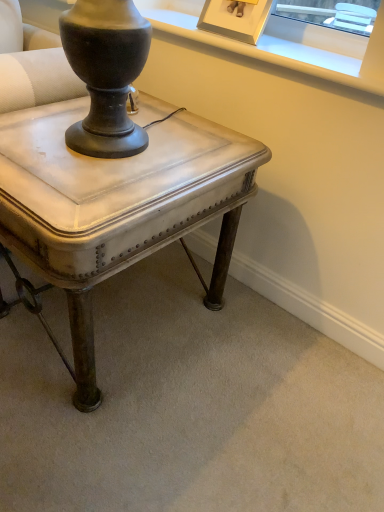
What do you see at coordinates (235, 19) in the screenshot? I see `gold-framed picture at upper center` at bounding box center [235, 19].

You are a GUI agent. You are given a task and a screenshot of the screen. Output one action in this format:
    pyautogui.click(x=<x>, y=<y>)
    Task: Click on the gold-framed picture at upper center
    This screenshot has width=384, height=512.
    Given the screenshot: What is the action you would take?
    pyautogui.click(x=235, y=19)

Locate an element on the screen. This screenshot has width=384, height=512. metallic silver table at center is located at coordinates (116, 206).

Describe the element at coordinates (116, 206) in the screenshot. I see `metallic silver table at center` at that location.

You are a GUI agent. You are given a task and a screenshot of the screen. Output one action in this format:
    pyautogui.click(x=<x>, y=<y>)
    Task: Click on the gold-framed picture at upper center
    The height and width of the screenshot is (512, 384).
    Given the screenshot: What is the action you would take?
    pyautogui.click(x=235, y=19)

Would you say metallic silver table at center is to the left or to the right of gold-framed picture at upper center in the picture?

In the image, metallic silver table at center appears on the left side of gold-framed picture at upper center.

Considering the relative positions of metallic silver table at center and gold-framed picture at upper center in the image provided, is metallic silver table at center in front of gold-framed picture at upper center?

Yes, it is.

Is point (51, 240) less distant than point (238, 40)?

That is True.

From the picture: From the image's perspective, is metallic silver table at center on top of gold-framed picture at upper center?

No, from the image's perspective, metallic silver table at center is not above gold-framed picture at upper center.

From a real-world perspective, relative to gold-framed picture at upper center, is metallic silver table at center vertically above or below?

Clearly, from a real-world perspective, metallic silver table at center is below gold-framed picture at upper center.

Considering the sizes of objects metallic silver table at center and gold-framed picture at upper center in the image provided, who is thinner, metallic silver table at center or gold-framed picture at upper center?

With smaller width is gold-framed picture at upper center.

Considering the relative sizes of metallic silver table at center and gold-framed picture at upper center in the image provided, is metallic silver table at center taller than gold-framed picture at upper center?

Correct, metallic silver table at center is much taller as gold-framed picture at upper center.

Who is bigger, metallic silver table at center or gold-framed picture at upper center?

metallic silver table at center.

Would you say metallic silver table at center is outside gold-framed picture at upper center?

Indeed, metallic silver table at center is completely outside gold-framed picture at upper center.

Is metallic silver table at center not near gold-framed picture at upper center?

That's not correct — metallic silver table at center is a little close to gold-framed picture at upper center.

Could you tell me if metallic silver table at center is facing gold-framed picture at upper center?

No, metallic silver table at center is not facing towards gold-framed picture at upper center.

Where is `table lying in front of the gold-framed picture at upper center`? table lying in front of the gold-framed picture at upper center is located at coordinates (116, 206).

Consider the image. Is gold-framed picture at upper center to the left or to the right of metallic silver table at center in the image?

From the image, it's evident that gold-framed picture at upper center is to the right of metallic silver table at center.

Considering their positions, is gold-framed picture at upper center located in front of or behind metallic silver table at center?

Visually, gold-framed picture at upper center is located behind metallic silver table at center.

Is point (254, 23) positioned before point (106, 264)?

No, it is not.

From the image's perspective, is gold-framed picture at upper center located above metallic silver table at center?

Correct, gold-framed picture at upper center appears higher than metallic silver table at center in the image.

From a real-world perspective, is gold-framed picture at upper center located beneath metallic silver table at center?

No.

Based on the photo, looking at their sizes, would you say gold-framed picture at upper center is wider or thinner than metallic silver table at center?

gold-framed picture at upper center is thinner than metallic silver table at center.

Between gold-framed picture at upper center and metallic silver table at center, which one has more height?

With more height is metallic silver table at center.

Is gold-framed picture at upper center smaller than metallic silver table at center?

Yes.

Do you think gold-framed picture at upper center is within metallic silver table at center, or outside of it?

gold-framed picture at upper center is not enclosed by metallic silver table at center.

Is gold-framed picture at upper center not near metallic silver table at center?

They are positioned close to each other.

Is gold-framed picture at upper center facing away from metallic silver table at center?

No, gold-framed picture at upper center is not facing the opposite direction of metallic silver table at center.

At what (x,y) coordinates should I click in order to perform the action: click on picture frame above the metallic silver table at center (from a real-world perspective). Please return your answer as a coordinate pair (x, y). Looking at the image, I should click on (235, 19).

Where is `table beneath the gold-framed picture at upper center (from a real-world perspective)`? This screenshot has height=512, width=384. table beneath the gold-framed picture at upper center (from a real-world perspective) is located at coordinates (116, 206).

The width and height of the screenshot is (384, 512). What are the coordinates of `table below the gold-framed picture at upper center (from the image's perspective)` in the screenshot? It's located at pyautogui.click(x=116, y=206).